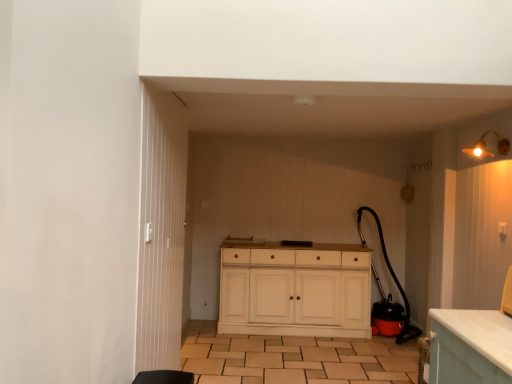
Question: Should I look upward or downward to see brown tile at center?

Choices:
 (A) down
 (B) up

Answer: (A)

Question: Is white wood cabinet at center oriented towards brown tile at center?

Choices:
 (A) yes
 (B) no

Answer: (A)

Question: Is white wood cabinet at center positioned behind brown tile at center?

Choices:
 (A) yes
 (B) no

Answer: (A)

Question: Would you consider white wood cabinet at center to be distant from brown tile at center?

Choices:
 (A) no
 (B) yes

Answer: (A)

Question: Does white wood cabinet at center have a greater width compared to brown tile at center?

Choices:
 (A) yes
 (B) no

Answer: (B)

Question: Does white wood cabinet at center have a larger size compared to brown tile at center?

Choices:
 (A) yes
 (B) no

Answer: (A)

Question: Considering the relative sizes of white wood cabinet at center and brown tile at center in the image provided, is white wood cabinet at center thinner than brown tile at center?

Choices:
 (A) yes
 (B) no

Answer: (A)

Question: Is white wooden door at center oriented away from white wood cabinet at center?

Choices:
 (A) no
 (B) yes

Answer: (A)

Question: Is white wooden door at center placed right next to white wood cabinet at center?

Choices:
 (A) yes
 (B) no

Answer: (B)

Question: Could white wood cabinet at center be considered to be inside white wooden door at center?

Choices:
 (A) no
 (B) yes

Answer: (A)

Question: Can you confirm if white wooden door at center is thinner than white wood cabinet at center?

Choices:
 (A) yes
 (B) no

Answer: (A)

Question: Is white wooden door at center behind white wood cabinet at center?

Choices:
 (A) yes
 (B) no

Answer: (B)

Question: Can we say white wooden door at center lies outside white wood cabinet at center?

Choices:
 (A) yes
 (B) no

Answer: (A)

Question: From a real-world perspective, is matte gold light fixture at upper right over white wood cabinet at center?

Choices:
 (A) no
 (B) yes

Answer: (B)